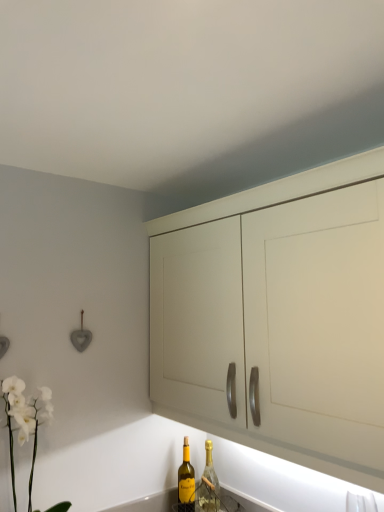
Question: Can you confirm if matte white cabinet at center is smaller than white matte orchid at lower left?

Choices:
 (A) yes
 (B) no

Answer: (B)

Question: Is matte white cabinet at center to the left of white matte orchid at lower left from the viewer's perspective?

Choices:
 (A) yes
 (B) no

Answer: (B)

Question: Is matte white cabinet at center not near white matte orchid at lower left?

Choices:
 (A) yes
 (B) no

Answer: (B)

Question: Is matte white cabinet at center in contact with white matte orchid at lower left?

Choices:
 (A) yes
 (B) no

Answer: (B)

Question: Can you confirm if matte white cabinet at center is shorter than white matte orchid at lower left?

Choices:
 (A) no
 (B) yes

Answer: (A)

Question: Considering their positions, is white matte orchid at lower left located in front of or behind matte white cabinet at center?

Choices:
 (A) front
 (B) behind

Answer: (B)

Question: Looking at their shapes, would you say white matte orchid at lower left is wider or thinner than matte white cabinet at center?

Choices:
 (A) thin
 (B) wide

Answer: (A)

Question: Considering the positions of white matte orchid at lower left and matte white cabinet at center in the image, is white matte orchid at lower left bigger or smaller than matte white cabinet at center?

Choices:
 (A) small
 (B) big

Answer: (A)

Question: From a real-world perspective, is white matte orchid at lower left physically located above or below matte white cabinet at center?

Choices:
 (A) below
 (B) above

Answer: (A)

Question: Based on their sizes in the image, would you say white matte orchid at lower left is bigger or smaller than yellow glass bottle at lower center, which is the 1th bottle from left to right?

Choices:
 (A) small
 (B) big

Answer: (B)

Question: From the image's perspective, is white matte orchid at lower left above or below yellow glass bottle at lower center, marked as the 2th bottle in a right-to-left arrangement?

Choices:
 (A) below
 (B) above

Answer: (B)

Question: From a real-world perspective, is white matte orchid at lower left physically located above or below yellow glass bottle at lower center, marked as the 2th bottle in a right-to-left arrangement?

Choices:
 (A) below
 (B) above

Answer: (B)

Question: Is point (16, 417) positioned closer to the camera than point (188, 495)?

Choices:
 (A) farther
 (B) closer

Answer: (B)

Question: In the image, is matte white cabinet at center on the left side or the right side of white matte orchid at lower left?

Choices:
 (A) left
 (B) right

Answer: (B)

Question: From the image's perspective, is matte white cabinet at center located above or below white matte orchid at lower left?

Choices:
 (A) below
 (B) above

Answer: (B)